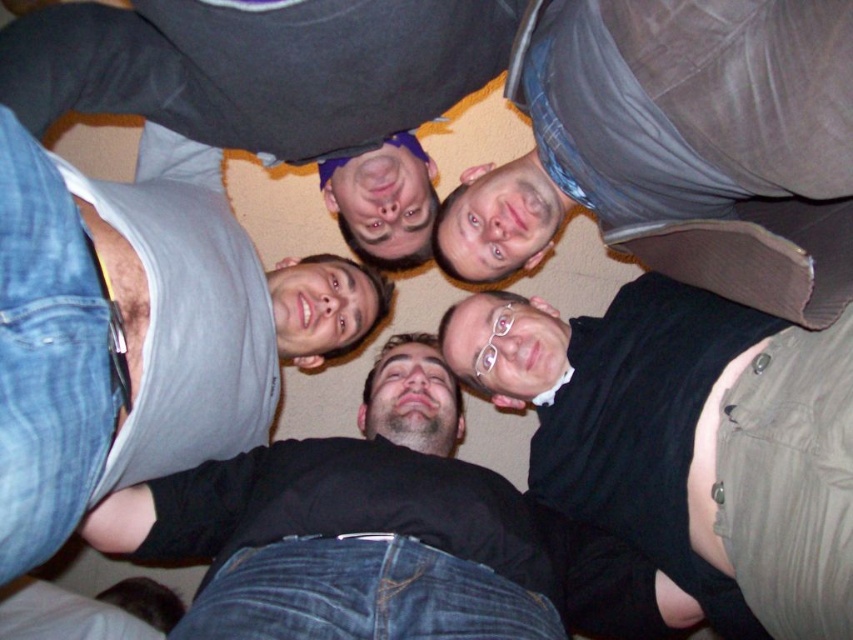
Question: Which of the following is the closest to the observer?

Choices:
 (A) (107, 24)
 (B) (746, 51)
 (C) (582, 385)
 (D) (194, 417)

Answer: (B)

Question: Is black matte shirt at lower right to the right of gray fabric tank top at upper left from the viewer's perspective?

Choices:
 (A) yes
 (B) no

Answer: (A)

Question: Does matte black shirt at upper center have a larger size compared to gray matte tank top at upper center?

Choices:
 (A) no
 (B) yes

Answer: (B)

Question: Does matte black shirt at upper center appear on the left side of gray fabric tank top at upper left?

Choices:
 (A) no
 (B) yes

Answer: (A)

Question: Estimate the real-world distances between objects in this image. Which object is closer to the black matte shirt at lower right?

Choices:
 (A) gray matte tank top at upper center
 (B) gray fabric tank top at upper left

Answer: (A)

Question: Estimate the real-world distances between objects in this image. Which object is farther from the matte black shirt at upper center?

Choices:
 (A) gray fabric tank top at upper left
 (B) gray matte tank top at upper center

Answer: (A)